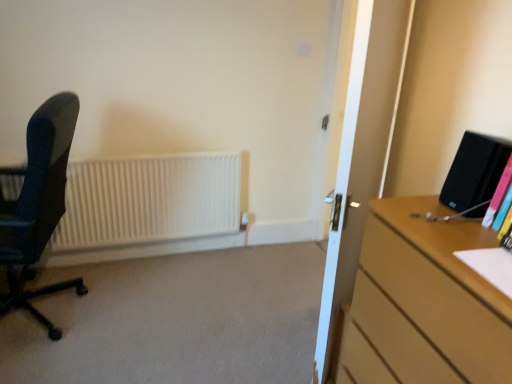
Find the location of a particular element. This screenshot has height=384, width=512. vacant space situated on the left part of multicolored plastic book at right is located at coordinates (429, 223).